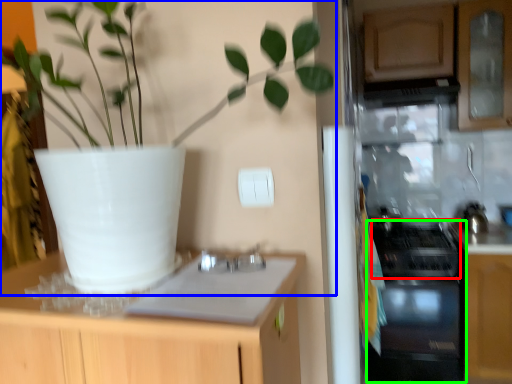
Question: Considering the real-world distances, which object is farthest from gas stove (highlighted by a red box)? houseplant (highlighted by a blue box) or oven (highlighted by a green box)?

Choices:
 (A) houseplant
 (B) oven

Answer: (A)